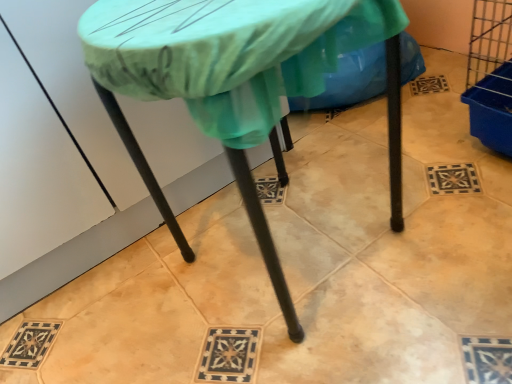
Where is `empty space that is to the right of matte green tablecloth at center`? The height and width of the screenshot is (384, 512). empty space that is to the right of matte green tablecloth at center is located at coordinates (436, 193).